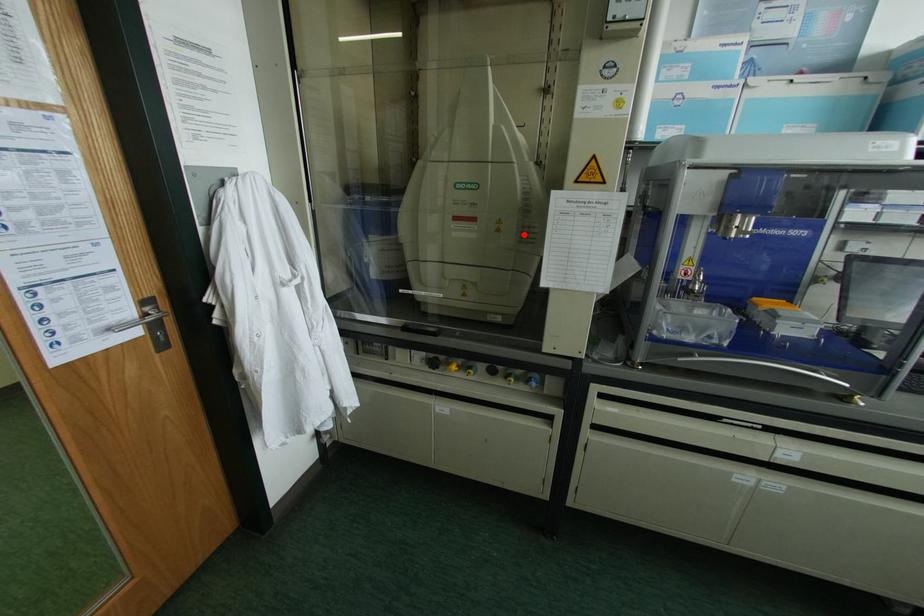
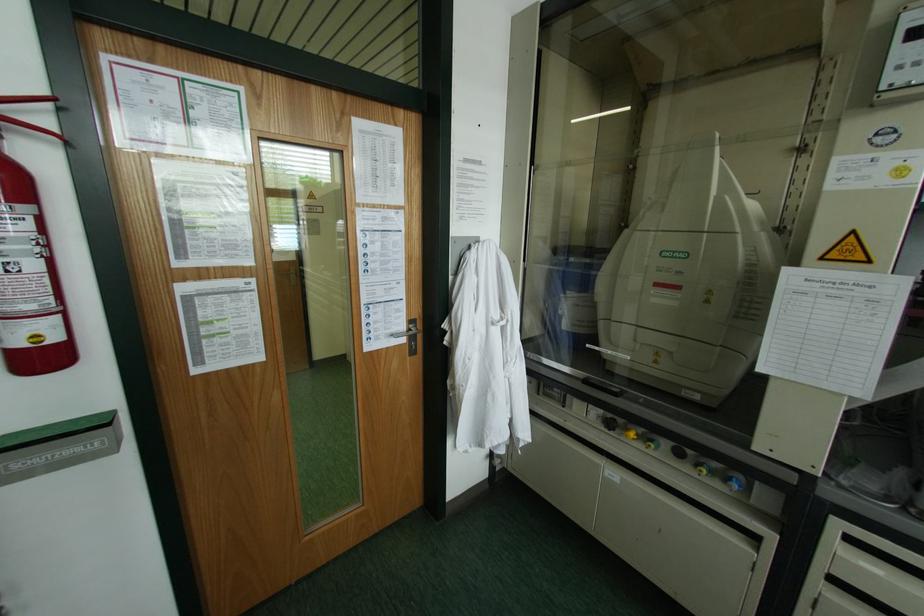
In the second image, find the point that corresponds to the highlighted location in the first image.

(743, 310)